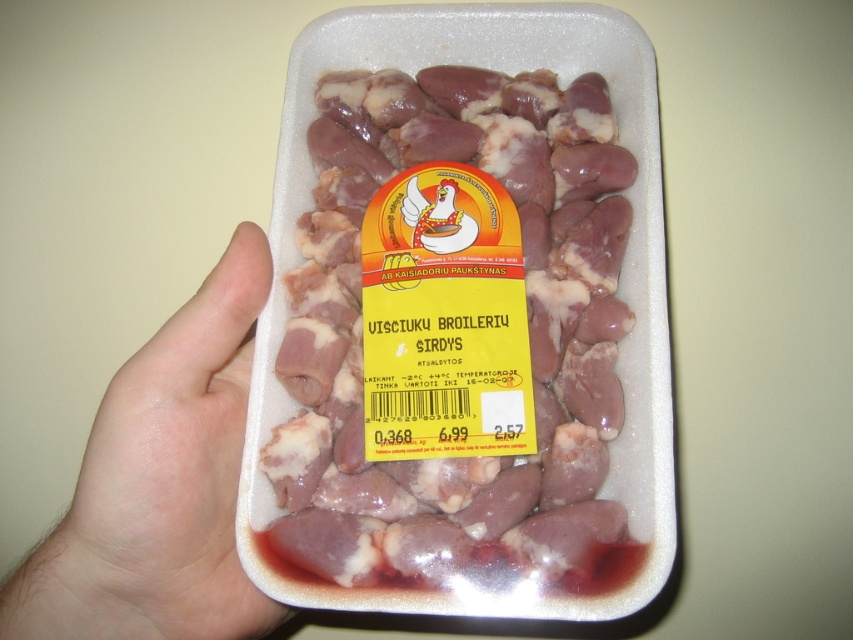
Question: Which point is closer to the camera?

Choices:
 (A) (138, 502)
 (B) (403, 102)

Answer: (A)

Question: Can you confirm if pinkish raw meat at center is positioned below pale skin at center?

Choices:
 (A) yes
 (B) no

Answer: (B)

Question: Is pinkish raw meat at center thinner than pale skin at center?

Choices:
 (A) yes
 (B) no

Answer: (B)

Question: Among these objects, which one is farthest from the camera?

Choices:
 (A) pale skin at center
 (B) pinkish raw meat at center

Answer: (B)

Question: Does pinkish raw meat at center appear on the right side of pale skin at center?

Choices:
 (A) yes
 (B) no

Answer: (A)